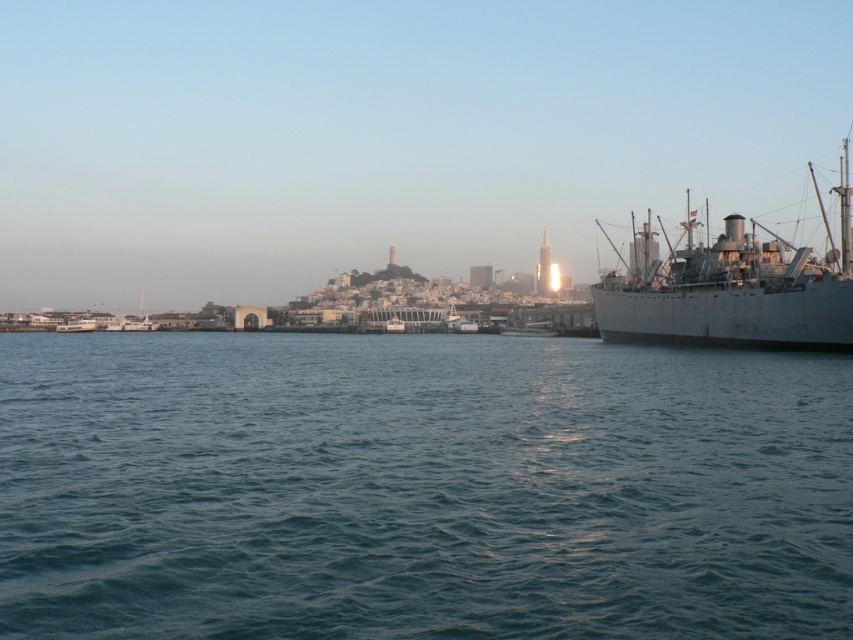
Question: Which object is the farthest from the metallic gray ferry at left?

Choices:
 (A) metallic gray boat at left
 (B) blue water at lower center
 (C) gray metallic ship at right

Answer: (C)

Question: Considering the real-world distances, which object is closest to the gray metallic ship at right?

Choices:
 (A) blue water at lower center
 (B) metallic gray ferry at left
 (C) metallic gray boat at left

Answer: (A)

Question: Which object is the farthest from the gray metallic ship at right?

Choices:
 (A) metallic gray boat at left
 (B) blue water at lower center
 (C) metallic gray ferry at left

Answer: (A)

Question: Does gray metallic ship at right have a larger size compared to metallic gray ferry at left?

Choices:
 (A) yes
 (B) no

Answer: (A)

Question: Is gray metallic ship at right behind metallic gray boat at left?

Choices:
 (A) no
 (B) yes

Answer: (A)

Question: Does blue water at lower center come behind metallic gray ferry at left?

Choices:
 (A) no
 (B) yes

Answer: (A)